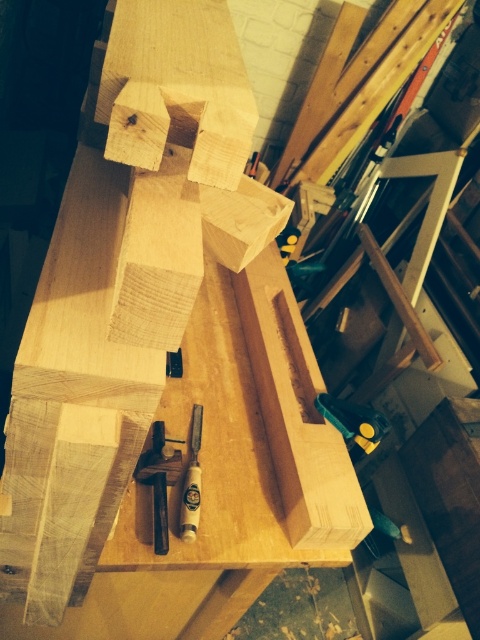
Is matte black chisel at center positioned in front of wooden chisel at center?

That is True.

Can you confirm if matte black chisel at center is taller than wooden chisel at center?

No.

This screenshot has height=640, width=480. What are the coordinates of `matte black chisel at center` in the screenshot? It's located at (159, 480).

Is metallic yellow clamp at lower right wider than wooden chisel at center?

Yes.

You are a GUI agent. You are given a task and a screenshot of the screen. Output one action in this format:
    pyautogui.click(x=<x>, y=<y>)
    Task: Click on the metallic yellow clamp at lower right
    Image resolution: width=480 pixels, height=640 pixels.
    Given the screenshot: What is the action you would take?
    pyautogui.click(x=352, y=422)

Locate an element on the screen. The image size is (480, 640). metallic yellow clamp at lower right is located at coordinates (352, 422).

Does matte black chisel at center appear on the left side of metallic yellow clamp at lower right?

Yes, matte black chisel at center is to the left of metallic yellow clamp at lower right.

Image resolution: width=480 pixels, height=640 pixels. In order to click on matte black chisel at center in this screenshot , I will do `click(159, 480)`.